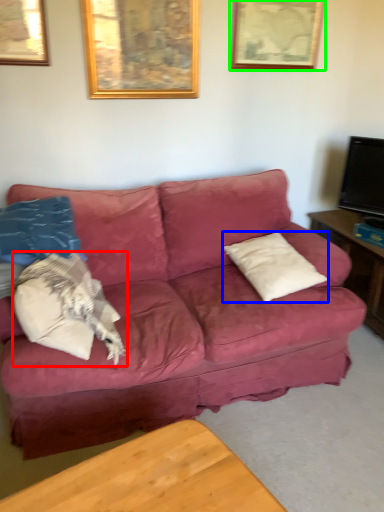
Question: Which object is the farthest from pillow (highlighted by a red box)? Choose among these: pillow (highlighted by a blue box) or picture frame (highlighted by a green box).

Choices:
 (A) pillow
 (B) picture frame

Answer: (B)